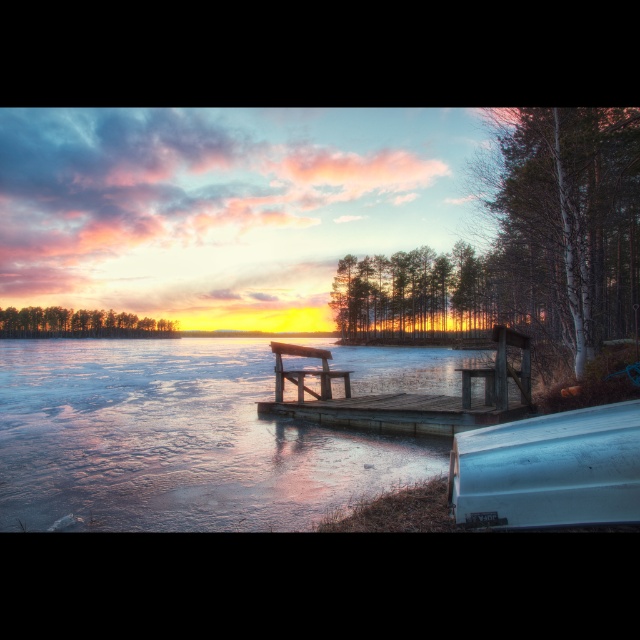
Question: Is wooden dock at center smaller than wooden bench at center?

Choices:
 (A) yes
 (B) no

Answer: (B)

Question: Which object is closer to the camera taking this photo?

Choices:
 (A) wooden bench at center
 (B) transparent ice at center
 (C) white matte boat at lower right
 (D) wooden dock at center

Answer: (C)

Question: Can you confirm if white matte boat at lower right is bigger than wooden bench at center?

Choices:
 (A) no
 (B) yes

Answer: (B)

Question: Among these objects, which one is farthest from the camera?

Choices:
 (A) white matte boat at lower right
 (B) wooden dock at center
 (C) transparent ice at center

Answer: (B)

Question: Is the position of white matte boat at lower right less distant than that of wooden dock at center?

Choices:
 (A) no
 (B) yes

Answer: (B)

Question: Which object is closer to the camera taking this photo?

Choices:
 (A) white matte boat at lower right
 (B) transparent ice at center

Answer: (A)